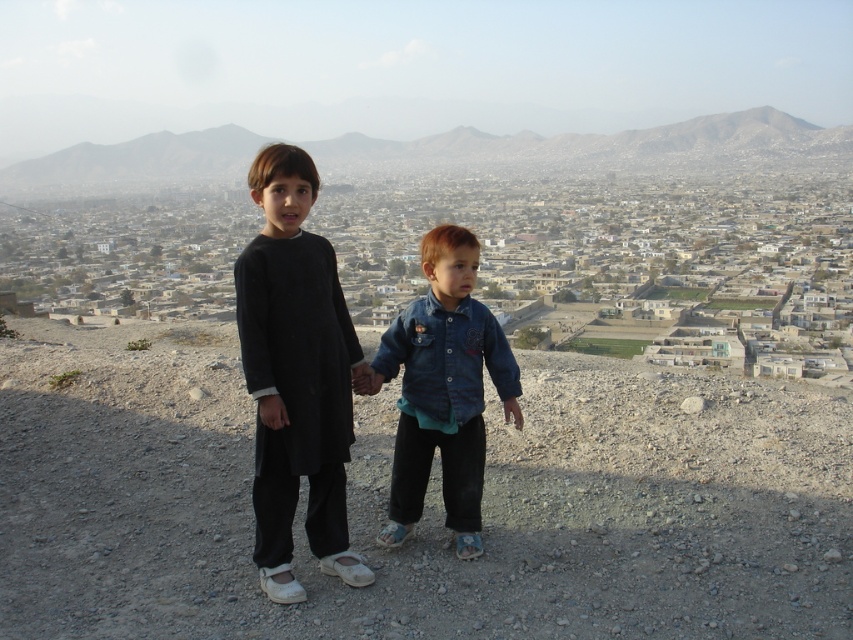
Question: Is gray rocky hill at center bigger than denim jacket at center?

Choices:
 (A) yes
 (B) no

Answer: (A)

Question: Does black cotton kurta at center appear over gray rocky hill at center?

Choices:
 (A) no
 (B) yes

Answer: (A)

Question: Which point appears farthest from the camera in this image?

Choices:
 (A) [213, 156]
 (B) [416, 413]
 (C) [341, 486]

Answer: (A)

Question: Which of the following is the closest to the observer?

Choices:
 (A) (405, 376)
 (B) (280, 157)

Answer: (B)

Question: Estimate the real-world distances between objects in this image. Which object is farther from the denim jacket at center?

Choices:
 (A) gray rocky hill at center
 (B) black cotton kurta at center

Answer: (A)

Question: Does black cotton kurta at center lie in front of gray rocky hill at center?

Choices:
 (A) no
 (B) yes

Answer: (B)